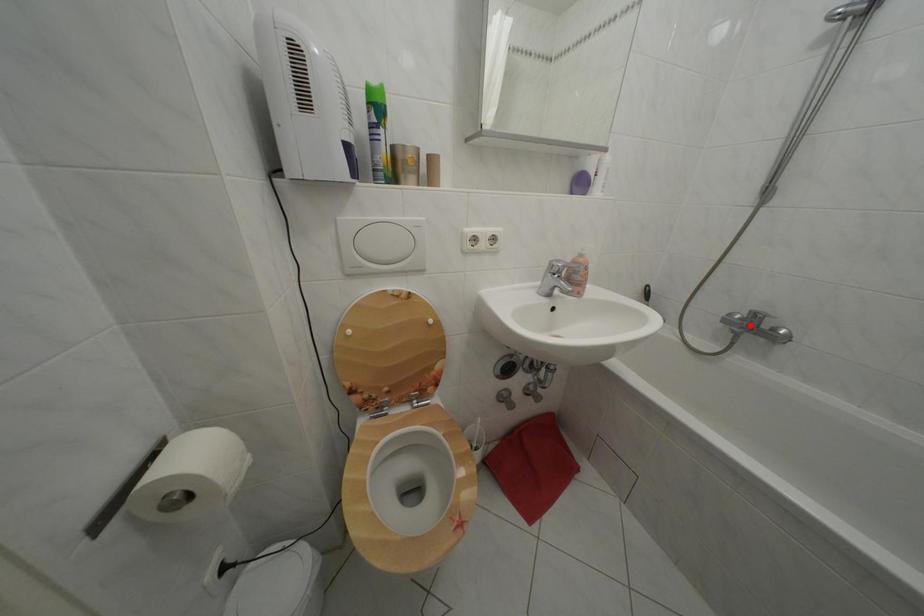
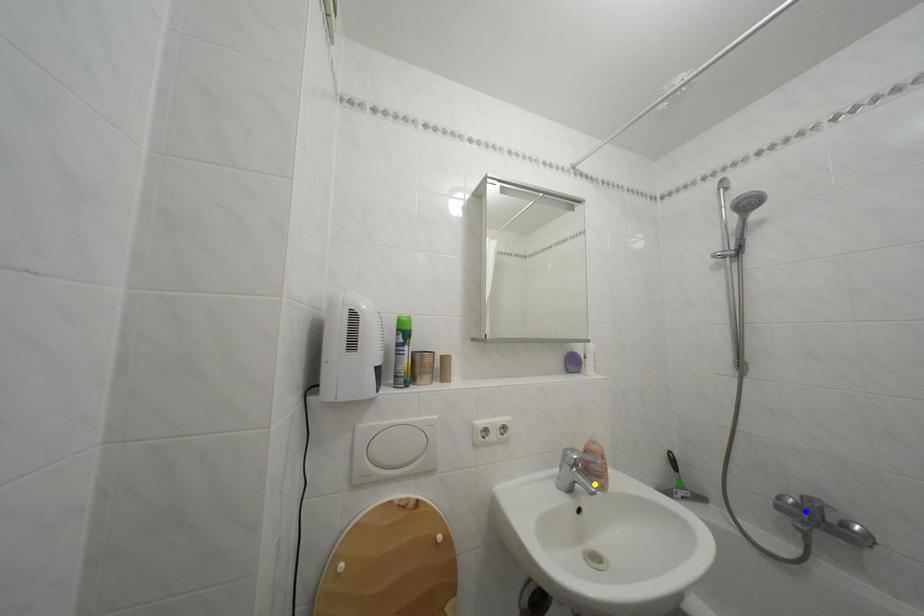
Question: I am providing you with two images of the same scene from different viewpoints. A red point is marked on the first image. You are given multiple points on the second image. Which spot in image 2 lines up with the point in image 1?

Choices:
 (A) blue point
 (B) green point
 (C) yellow point

Answer: (A)